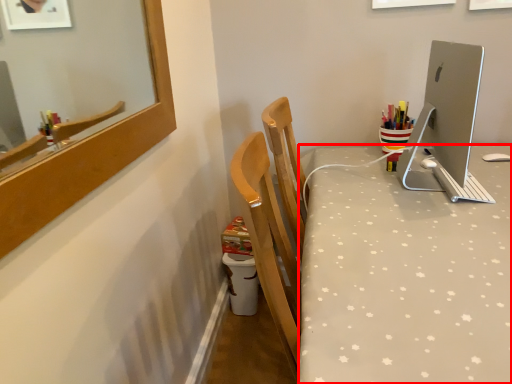
Question: Considering the relative positions of desk (annotated by the red box) and desktop computer in the image provided, where is desk (annotated by the red box) located with respect to the staircase?

Choices:
 (A) left
 (B) right

Answer: (B)